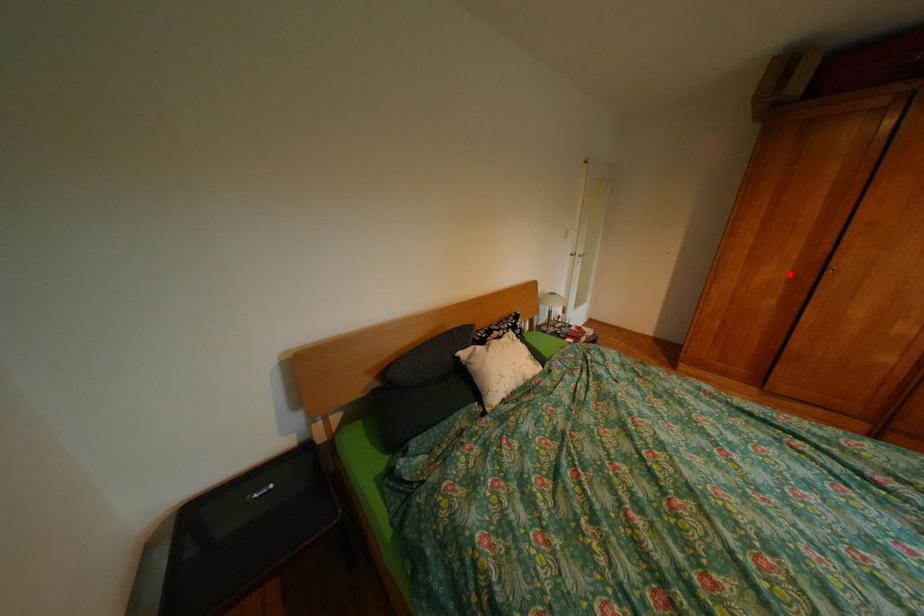
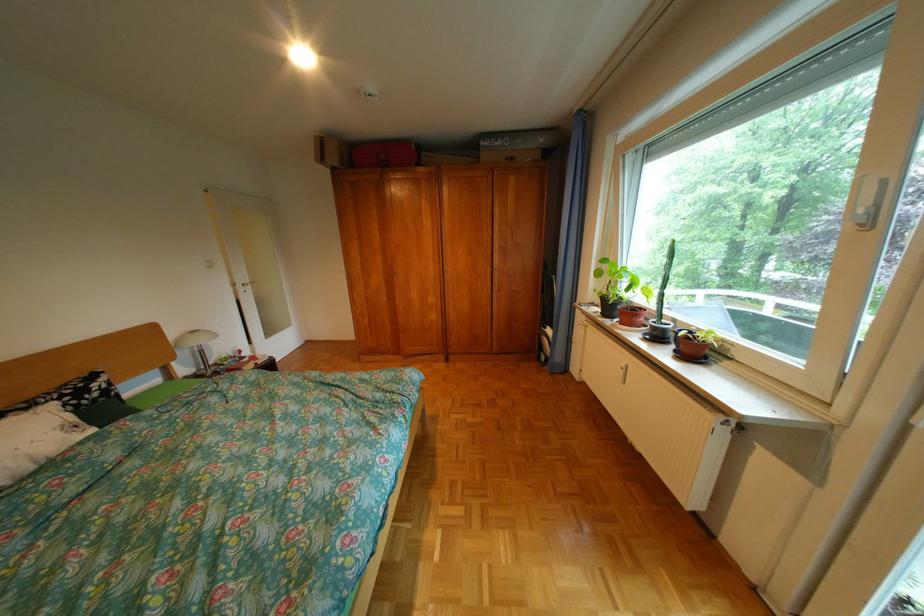
The point at the highlighted location is marked in the first image. Where is the corresponding point in the second image?

(392, 280)